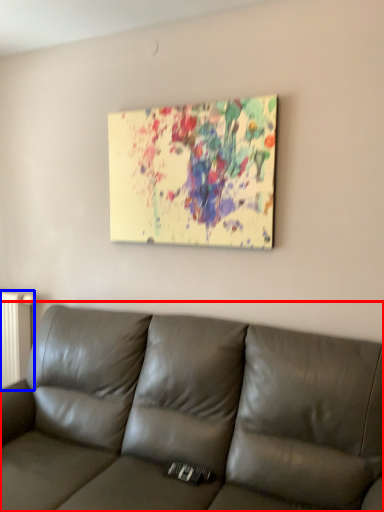
Question: Which point is further to the camera, studio couch (highlighted by a red box) or radiator (highlighted by a blue box)?

Choices:
 (A) studio couch
 (B) radiator

Answer: (B)